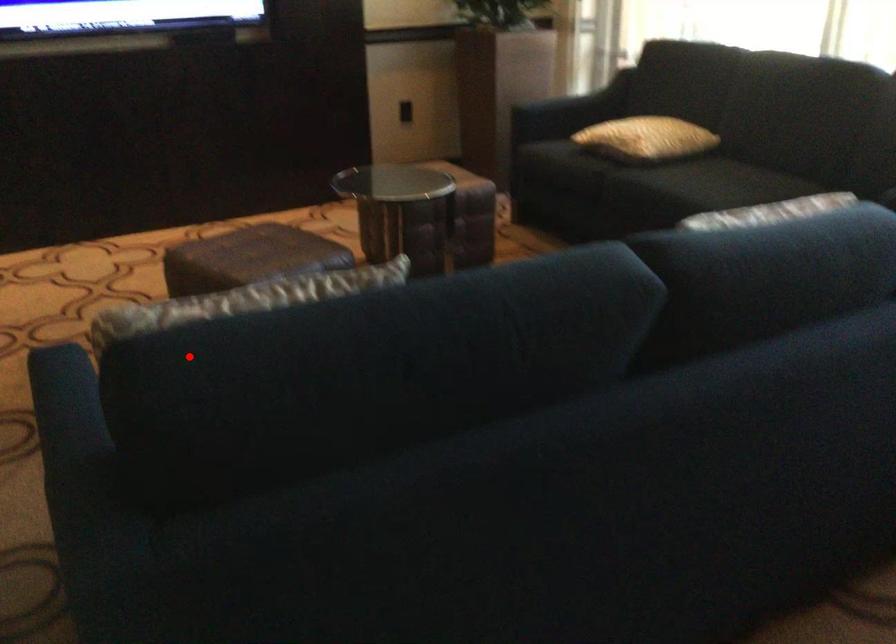
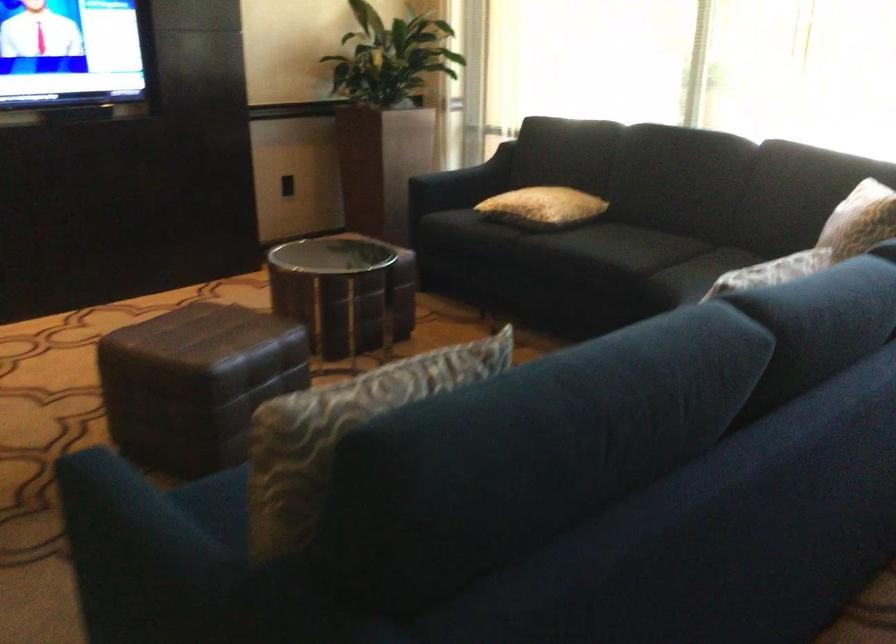
Question: I am providing you with two images of the same scene from different viewpoints. In image1, a red point is highlighted. Considering the same 3D point in image2, which of the following is correct?

Choices:
 (A) It is closer
 (B) It is farther

Answer: (B)